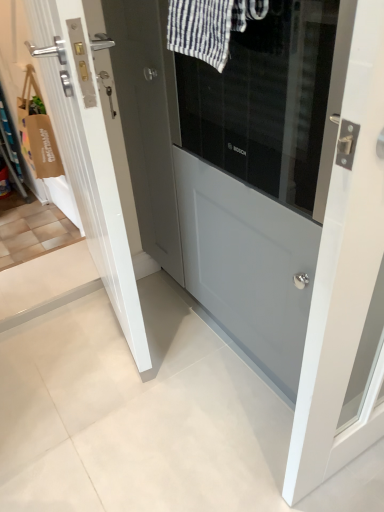
Find the location of a particular element. The height and width of the screenshot is (512, 384). white striped fabric at upper center is located at coordinates coord(209,26).

Measure the distance between point (246,14) and camera.

Point (246,14) and camera are 31.77 inches apart.

Identify the location of matte gray door at center, the 1th door positioned from the right. (263, 173).

The width and height of the screenshot is (384, 512). Describe the element at coordinates (263, 173) in the screenshot. I see `matte gray door at center, the 1th door positioned from the right` at that location.

This screenshot has width=384, height=512. I want to click on white striped fabric at upper center, so click(209, 26).

Which point is more distant from viewer, (124, 261) or (315, 247)?

The point (124, 261) is behind.

Is white glossy door at center, which ranks as the first door in left-to-right order, closer to the viewer compared to matte gray door at center, the 2th door viewed from the left?

No, it is not.

Does white glossy door at center, which ranks as the first door in left-to-right order, have a greater width compared to matte gray door at center, the 2th door viewed from the left?

In fact, white glossy door at center, which ranks as the first door in left-to-right order, might be narrower than matte gray door at center, the 2th door viewed from the left.

Are white glossy door at center, which ranks as the first door in left-to-right order, and matte gray door at center, the 1th door positioned from the right, making contact?

No.

Consider the image. Is white striped fabric at upper center positioned behind white glossy door at center, the 2th door from the right?

No, white striped fabric at upper center is in front of white glossy door at center, the 2th door from the right.

From a real-world perspective, starting from the white striped fabric at upper center, which door is the 1st one below it? Please provide its 2D coordinates.

[(90, 169)]

Is white striped fabric at upper center surrounding white glossy door at center, the 2th door from the right?

No, white glossy door at center, the 2th door from the right, is not a part of white striped fabric at upper center.

From a real-world perspective, which object rests below the other?

white glossy door at center, the 2th door from the right, is physically lower.

Does white glossy door at center, which ranks as the first door in left-to-right order, have a larger size compared to white striped fabric at upper center?

Yes, white glossy door at center, which ranks as the first door in left-to-right order, is bigger than white striped fabric at upper center.

From a real-world perspective, is white glossy door at center, which ranks as the first door in left-to-right order, located higher than white striped fabric at upper center?

No, from a real-world perspective, white glossy door at center, which ranks as the first door in left-to-right order, is not on top of white striped fabric at upper center.

In the scene shown: Is white glossy door at center, which ranks as the first door in left-to-right order, turned away from white striped fabric at upper center?

Absolutely, white glossy door at center, which ranks as the first door in left-to-right order, is directed away from white striped fabric at upper center.

Is point (62, 152) positioned before point (253, 6)?

That is False.

How many degrees apart are the facing directions of white striped fabric at upper center and matte gray door at center, the 1th door positioned from the right?

white striped fabric at upper center and matte gray door at center, the 1th door positioned from the right, are facing 0.000383 degrees away from each other.

Is white striped fabric at upper center taller than matte gray door at center, the 1th door positioned from the right?

Incorrect, the height of white striped fabric at upper center is not larger of that of matte gray door at center, the 1th door positioned from the right.

Does white striped fabric at upper center have a greater width compared to matte gray door at center, the 1th door positioned from the right?

No.

From a real-world perspective, count 2nd doors downward from the white striped fabric at upper center and point to it. Please provide its 2D coordinates.

[(263, 173)]

Are matte gray door at center, the 1th door positioned from the right, and white glossy door at center, which ranks as the first door in left-to-right order, located far from each other?

No.

Is matte gray door at center, the 2th door viewed from the left, oriented away from white glossy door at center, the 2th door from the right?

No, white glossy door at center, the 2th door from the right, is not at the back of matte gray door at center, the 2th door viewed from the left.

In terms of width, does matte gray door at center, the 1th door positioned from the right, look wider or thinner when compared to white glossy door at center, the 2th door from the right?

Clearly, matte gray door at center, the 1th door positioned from the right, has more width compared to white glossy door at center, the 2th door from the right.

This screenshot has height=512, width=384. Identify the location of door located above the matte gray door at center, the 1th door positioned from the right (from a real-world perspective). (90, 169).

From the picture: Could you tell me if matte gray door at center, the 2th door viewed from the left, is facing white striped fabric at upper center?

Yes.

Is matte gray door at center, the 2th door viewed from the left, smaller than white striped fabric at upper center?

No.

From the image's perspective, is matte gray door at center, the 1th door positioned from the right, above or below white striped fabric at upper center?

matte gray door at center, the 1th door positioned from the right, is below white striped fabric at upper center.

Is matte gray door at center, the 2th door viewed from the left, beside white striped fabric at upper center?

No.

The image size is (384, 512). I want to click on door that is on the left side of matte gray door at center, the 2th door viewed from the left, so click(x=90, y=169).

Identify the location of door behind the white striped fabric at upper center. The height and width of the screenshot is (512, 384). (90, 169).

Estimate the real-world distances between objects in this image. Which object is closer to white striped fabric at upper center, matte gray door at center, the 2th door viewed from the left, or white glossy door at center, the 2th door from the right?

matte gray door at center, the 2th door viewed from the left.

When comparing their distances from white glossy door at center, the 2th door from the right, does white striped fabric at upper center or matte gray door at center, the 2th door viewed from the left, seem further?

The object further to white glossy door at center, the 2th door from the right, is white striped fabric at upper center.

In the scene shown: Estimate the real-world distances between objects in this image. Which object is further from white glossy door at center, the 2th door from the right, matte gray door at center, the 2th door viewed from the left, or white striped fabric at upper center?

Among the two, white striped fabric at upper center is located further to white glossy door at center, the 2th door from the right.

Which object lies nearer to the anchor point white striped fabric at upper center, white glossy door at center, the 2th door from the right, or matte gray door at center, the 1th door positioned from the right?

matte gray door at center, the 1th door positioned from the right.

Estimate the real-world distances between objects in this image. Which object is further from matte gray door at center, the 1th door positioned from the right, white striped fabric at upper center or white glossy door at center, the 2th door from the right?

white striped fabric at upper center.

In the scene shown: From the image, which object appears to be farther from matte gray door at center, the 2th door viewed from the left, white glossy door at center, which ranks as the first door in left-to-right order, or white striped fabric at upper center?

white striped fabric at upper center.

You are a GUI agent. You are given a task and a screenshot of the screen. Output one action in this format:
    pyautogui.click(x=<x>, y=<y>)
    Task: Click on the bath towel between white glossy door at center, which ranks as the first door in left-to-right order, and matte gray door at center, the 1th door positioned from the right, in the horizontal direction
    Image resolution: width=384 pixels, height=512 pixels.
    Given the screenshot: What is the action you would take?
    pyautogui.click(x=209, y=26)